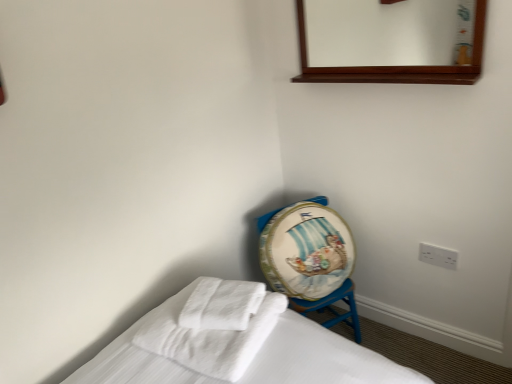
At what (x,y) coordinates should I click in order to perform the action: click on free space above white soft towel at center, the 1th bath towel from the right (from a real-world perspective). Please return your answer as a coordinate pair (x, y). The width and height of the screenshot is (512, 384). Looking at the image, I should click on (220, 301).